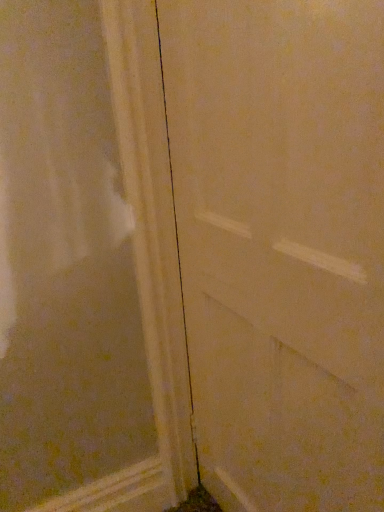
Describe the element at coordinates (281, 245) in the screenshot. I see `white matte door at center` at that location.

Find the location of `white matte door at center`. white matte door at center is located at coordinates (281, 245).

Locate an element on the screen. The width and height of the screenshot is (384, 512). white matte door at center is located at coordinates (281, 245).